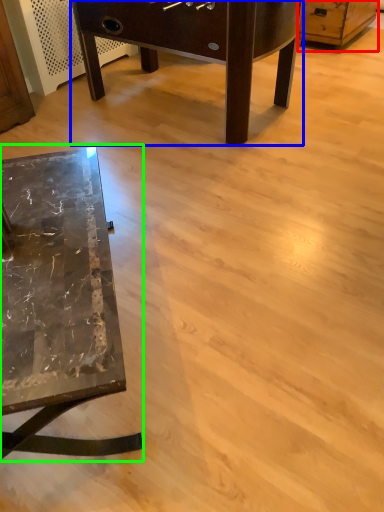
Question: Based on their relative distances, which object is farther from dresser (highlighted by a red box)? Choose from table (highlighted by a blue box) and table (highlighted by a green box).

Choices:
 (A) table
 (B) table

Answer: (B)